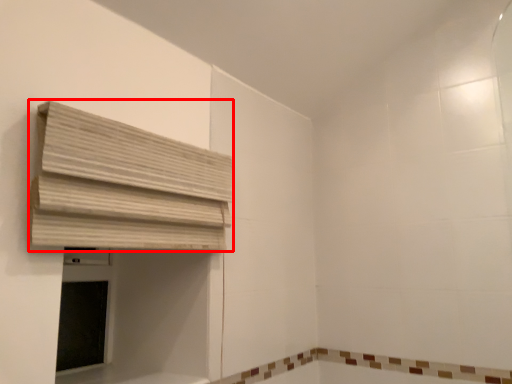
Question: In this image, where is curtain (annotated by the red box) located relative to bath?

Choices:
 (A) left
 (B) right

Answer: (A)